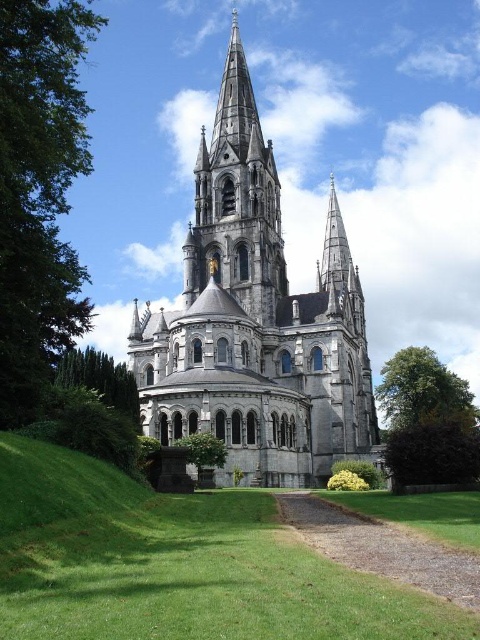
Question: Considering the relative positions of green leafy tree at right and green leafy tree at lower center in the image provided, where is green leafy tree at right located with respect to green leafy tree at lower center?

Choices:
 (A) left
 (B) right

Answer: (B)

Question: Which object appears farthest from the camera in this image?

Choices:
 (A) gray stone church at center
 (B) green leafy tree at lower center
 (C) green leafy tree at lower left

Answer: (A)

Question: Can you confirm if gray stone spire at center is positioned to the left of green leafy tree at right?

Choices:
 (A) no
 (B) yes

Answer: (B)

Question: Which object appears farthest from the camera in this image?

Choices:
 (A) green leafy tree at lower center
 (B) green leafy tree at lower left
 (C) green leafy tree at upper left
 (D) green leafy tree at right

Answer: (D)

Question: Does gray stone spire at center appear on the right side of green leafy tree at lower center?

Choices:
 (A) yes
 (B) no

Answer: (A)

Question: Which of the following is the closest to the observer?

Choices:
 (A) green leafy tree at upper left
 (B) green leafy tree at right
 (C) gray stone spire at center

Answer: (A)